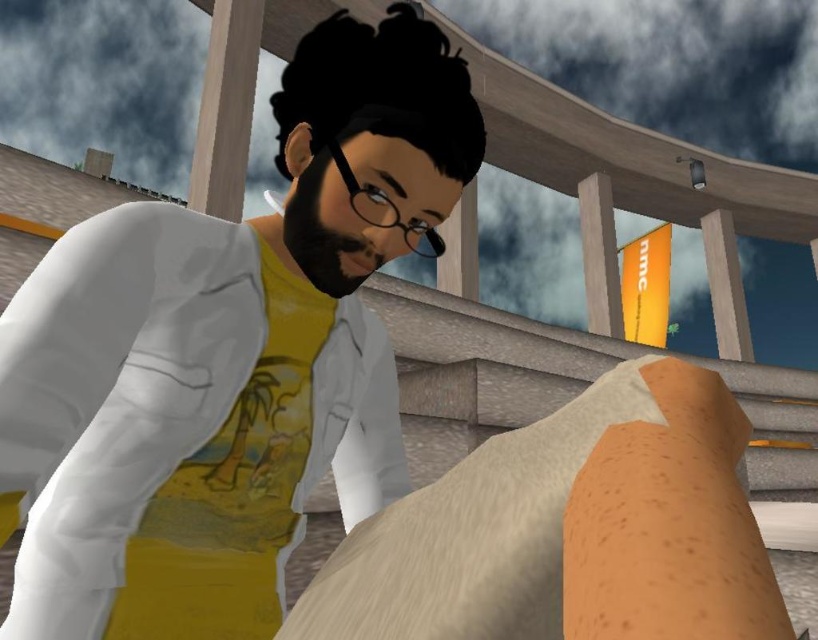
You are a drone operator trying to fly a drone with a wingspan of 6 feet between the wooden at upper center and the smooth gray pillar at upper right. Based on the scene, can the drone safely pass through the gap between them?

The distance between the wooden at upper center and the smooth gray pillar at upper right is 7.34 feet. Since the drone has a wingspan of 6 feet, it can safely pass through the gap as there is sufficient space.

You are navigating a virtual environment and need to locate the wooden structure at upper center. According to the coordinates provided, where exactly is the wooden at upper center positioned?

The wooden at upper center is precisely located at the coordinates point (599, 256).

You are a character in the scene and need to place a small object between the white matte lab coat at center and the wooden at upper center. Based on their positions, which object should be placed closer to the left side?

The white matte lab coat at center is positioned on the left side of wooden at upper center, so placing the small object closer to the left side would mean placing it near the white matte lab coat at center.